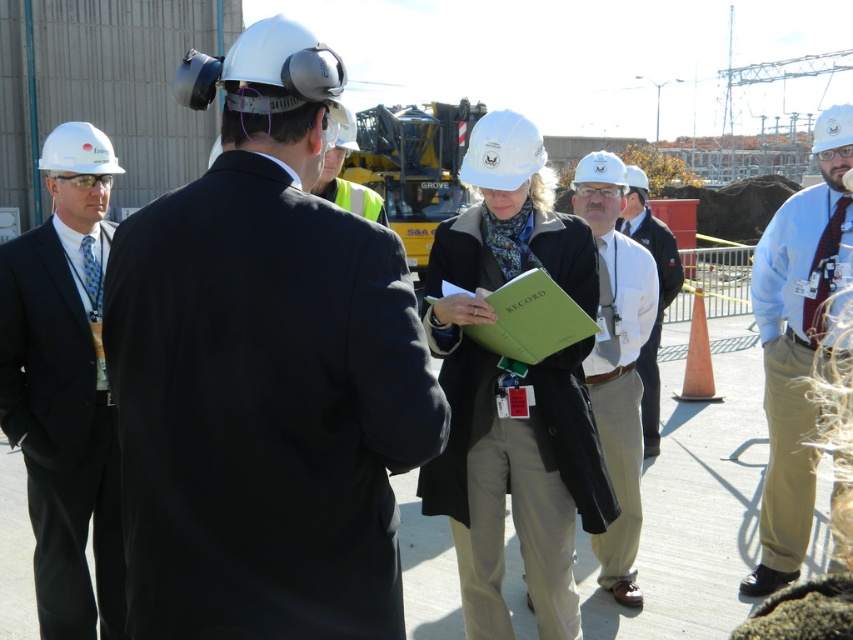
Question: Which object is farther from the camera taking this photo?

Choices:
 (A) white matte hard hat at center
 (B) matte black suit at left
 (C) yellow reflective vest at center
 (D) light blue shirt with tie at center

Answer: (A)

Question: In this image, where is matte black jacket at center located relative to white cotton shirt at center?

Choices:
 (A) below
 (B) above

Answer: (A)

Question: Among these points, which one is farthest from the camera?

Choices:
 (A) tap(654, 413)
 (B) tap(386, 611)
 (C) tap(601, 225)

Answer: (A)

Question: Where is white cotton shirt at center located in relation to yellow reflective vest at center in the image?

Choices:
 (A) above
 (B) below

Answer: (B)

Question: Which of the following is the closest to the observer?

Choices:
 (A) (625, 317)
 (B) (379, 202)
 (C) (625, 204)
 (D) (577, 164)

Answer: (A)

Question: Considering the relative positions of light blue shirt with tie at center and white matte hard hat at center in the image provided, where is light blue shirt with tie at center located with respect to white matte hard hat at center?

Choices:
 (A) right
 (B) left

Answer: (B)